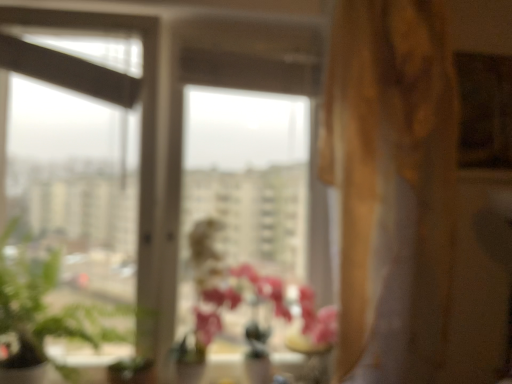
Question: From a real-world perspective, is pink matte vase at center on top of transparent glass vase at center?

Choices:
 (A) yes
 (B) no

Answer: (A)

Question: Considering the relative sizes of pink matte vase at center and transparent glass vase at center in the image provided, is pink matte vase at center shorter than transparent glass vase at center?

Choices:
 (A) no
 (B) yes

Answer: (A)

Question: Is pink matte vase at center looking in the opposite direction of transparent glass vase at center?

Choices:
 (A) no
 (B) yes

Answer: (A)

Question: Is transparent glass vase at center located within pink matte vase at center?

Choices:
 (A) no
 (B) yes

Answer: (B)

Question: Is pink matte vase at center to the left of transparent glass vase at center from the viewer's perspective?

Choices:
 (A) no
 (B) yes

Answer: (B)

Question: Does pink matte vase at center have a smaller size compared to transparent glass vase at center?

Choices:
 (A) no
 (B) yes

Answer: (A)

Question: Is transparent glass window at center looking in the opposite direction of transparent glass vase at center?

Choices:
 (A) no
 (B) yes

Answer: (A)

Question: Are transparent glass window at center and transparent glass vase at center beside each other?

Choices:
 (A) yes
 (B) no

Answer: (B)

Question: Is transparent glass window at center surrounding transparent glass vase at center?

Choices:
 (A) yes
 (B) no

Answer: (A)

Question: Considering the relative positions of transparent glass window at center and transparent glass vase at center in the image provided, is transparent glass window at center to the right of transparent glass vase at center from the viewer's perspective?

Choices:
 (A) yes
 (B) no

Answer: (B)

Question: Considering the relative sizes of transparent glass window at center and transparent glass vase at center in the image provided, is transparent glass window at center shorter than transparent glass vase at center?

Choices:
 (A) yes
 (B) no

Answer: (B)

Question: Is transparent glass window at center not close to transparent glass vase at center?

Choices:
 (A) yes
 (B) no

Answer: (B)

Question: Is there a large distance between transparent glass vase at center and pink matte vase at center?

Choices:
 (A) no
 (B) yes

Answer: (A)